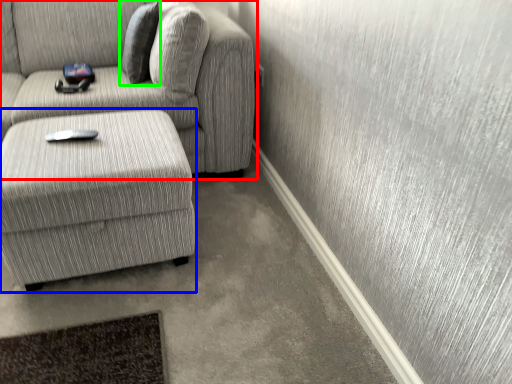
Question: Based on their relative distances, which object is nearer to studio couch (highlighted by a red box)? Choose from table (highlighted by a blue box) and pillow (highlighted by a green box).

Choices:
 (A) table
 (B) pillow

Answer: (B)